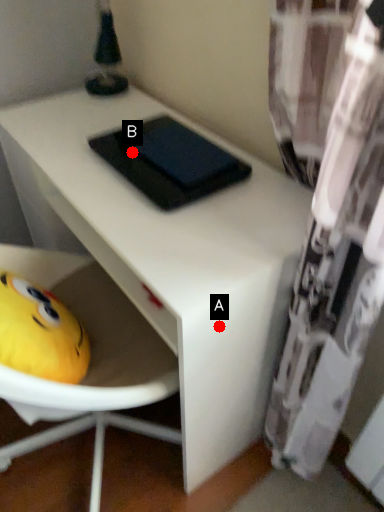
Question: Two points are circled on the image, labeled by A and B beside each circle. Which of the following is the closest to the observer?

Choices:
 (A) A is closer
 (B) B is closer

Answer: (A)